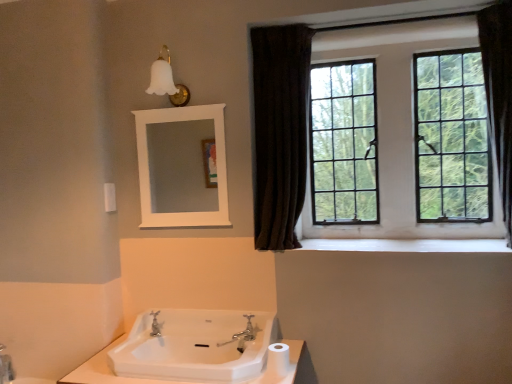
Find the location of `free spot to the right of dark brown velvet curtain at upper right`. free spot to the right of dark brown velvet curtain at upper right is located at coordinates (344, 243).